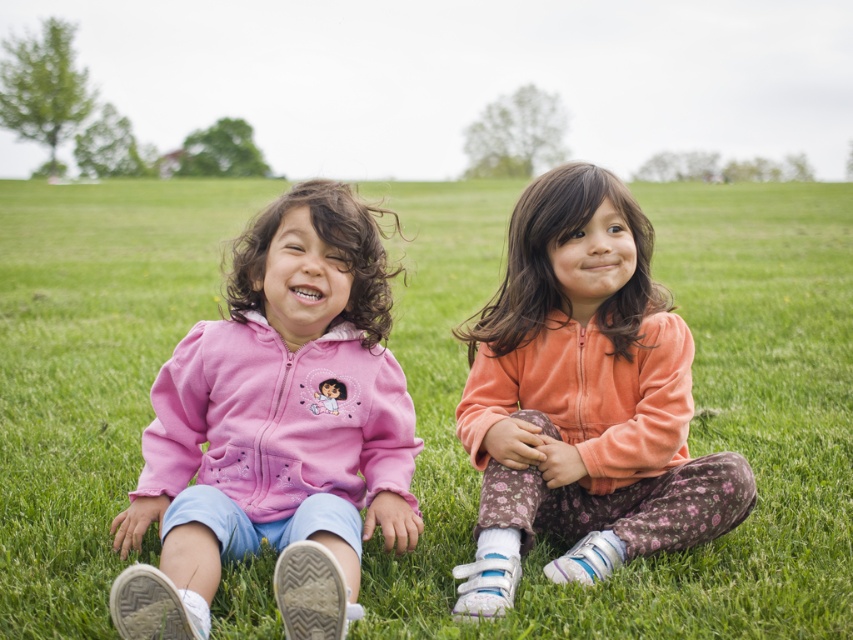
Question: Which point appears farthest from the camera in this image?

Choices:
 (A) (845, 237)
 (B) (263, 237)

Answer: (A)

Question: Does pink fleece jackets at center have a smaller size compared to pink fleece jacket at left?

Choices:
 (A) yes
 (B) no

Answer: (B)

Question: Considering the real-world distances, which object is closest to the velvet orange hoodie at center?

Choices:
 (A) pink fleece jacket at left
 (B) pink fleece jackets at center

Answer: (A)

Question: Can you confirm if pink fleece jacket at left is positioned below velvet orange hoodie at center?

Choices:
 (A) yes
 (B) no

Answer: (A)

Question: Can you confirm if pink fleece jackets at center is positioned above velvet orange hoodie at center?

Choices:
 (A) no
 (B) yes

Answer: (B)

Question: Considering the real-world distances, which object is farthest from the pink fleece jackets at center?

Choices:
 (A) pink fleece jacket at left
 (B) velvet orange hoodie at center

Answer: (A)